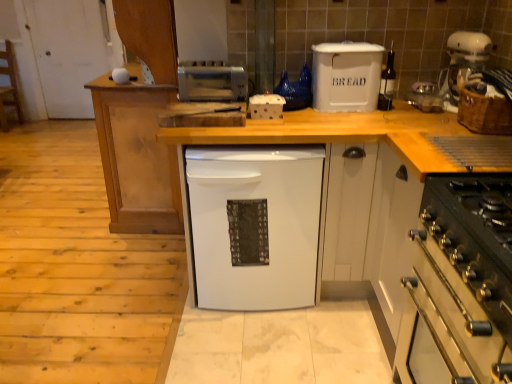
Where is `vacant area in front of white plastic container at center, which is counted as the second appliance, starting from the left`? vacant area in front of white plastic container at center, which is counted as the second appliance, starting from the left is located at coordinates (278, 129).